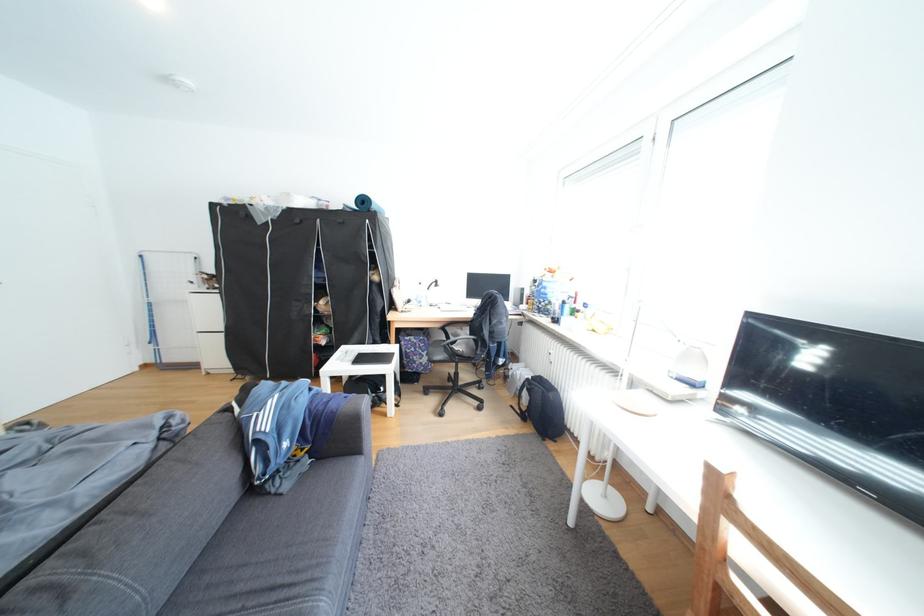
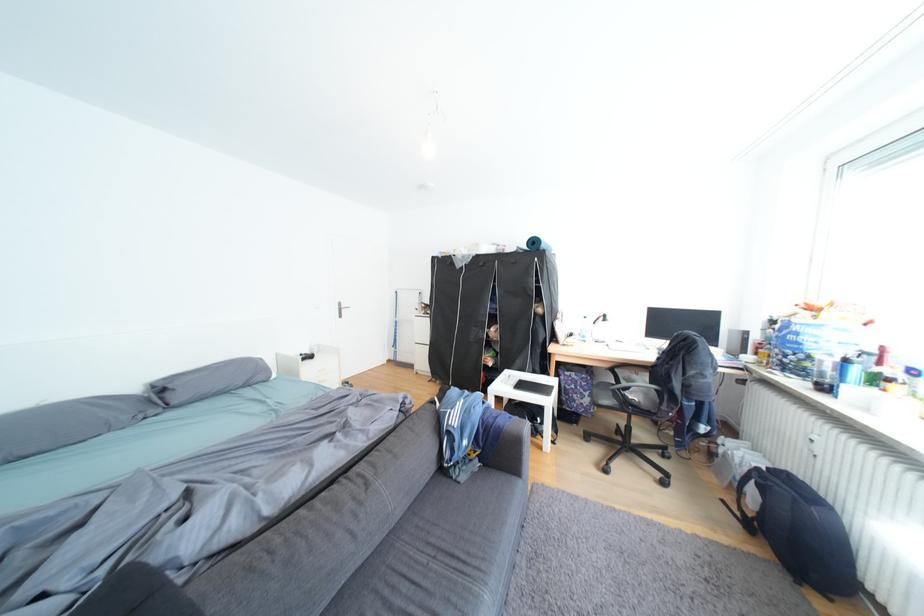
Locate, in the second image, the point that corresponds to the point at 241,410 in the first image.

(446, 403)